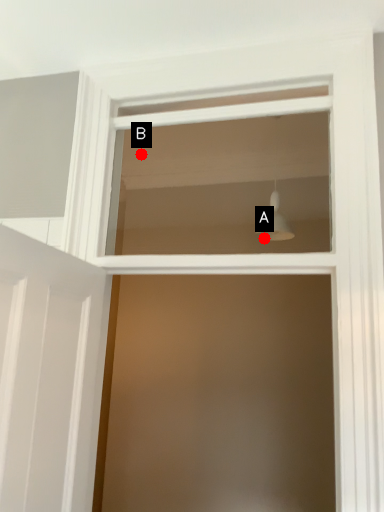
Question: Two points are circled on the image, labeled by A and B beside each circle. Which point is farther to the camera?

Choices:
 (A) A is further
 (B) B is further

Answer: (B)